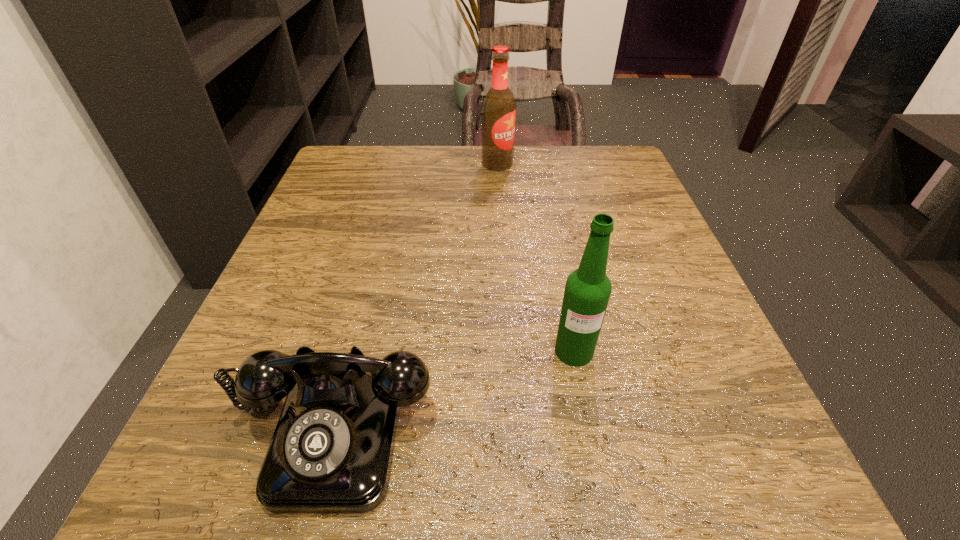
You are a GUI agent. You are given a task and a screenshot of the screen. Output one action in this format:
    pyautogui.click(x=<x>, y=<y>)
    Task: Click on the free space that is in between the nearer beer bottle and the farther beer bottle
    This screenshot has width=960, height=540.
    Given the screenshot: What is the action you would take?
    pyautogui.click(x=536, y=258)

The height and width of the screenshot is (540, 960). In order to click on free space between the shortest object and the second object from left to right in this screenshot , I will do `click(415, 296)`.

You are a GUI agent. You are given a task and a screenshot of the screen. Output one action in this format:
    pyautogui.click(x=<x>, y=<y>)
    Task: Click on the free point between the nearer beer bottle and the telephone
    Image resolution: width=960 pixels, height=540 pixels.
    Given the screenshot: What is the action you would take?
    pyautogui.click(x=453, y=389)

Where is `empty space that is in between the leftmost object and the second object from right to left`? empty space that is in between the leftmost object and the second object from right to left is located at coordinates (415, 296).

Image resolution: width=960 pixels, height=540 pixels. In order to click on free space between the left beer bottle and the right beer bottle in this screenshot , I will do `click(536, 258)`.

Find the location of a particular element. unoccupied position between the right beer bottle and the left beer bottle is located at coordinates (536, 258).

The image size is (960, 540). Find the location of `unoccupied area between the nearer beer bottle and the left beer bottle`. unoccupied area between the nearer beer bottle and the left beer bottle is located at coordinates (536, 258).

Where is `blank region between the farthest object and the telephone`? blank region between the farthest object and the telephone is located at coordinates (415, 296).

You are a GUI agent. You are given a task and a screenshot of the screen. Output one action in this format:
    pyautogui.click(x=<x>, y=<y>)
    Task: Click on the free point between the shortest object and the second object from right to left
    
    Given the screenshot: What is the action you would take?
    pyautogui.click(x=415, y=296)

Identify the location of the second closest object relative to the leftmost object. This screenshot has width=960, height=540. (499, 106).